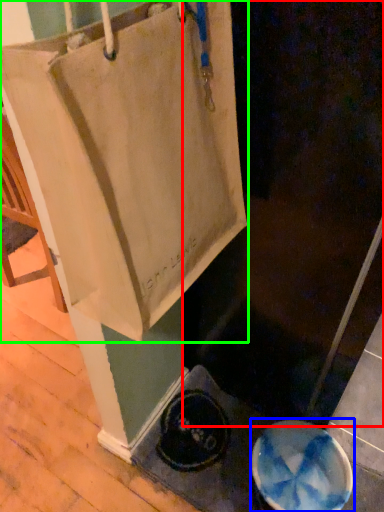
Question: Considering the real-world distances, which object is closest to screen door (highlighted by a red box)? manhole cover (highlighted by a blue box) or tote bag (highlighted by a green box).

Choices:
 (A) manhole cover
 (B) tote bag

Answer: (B)